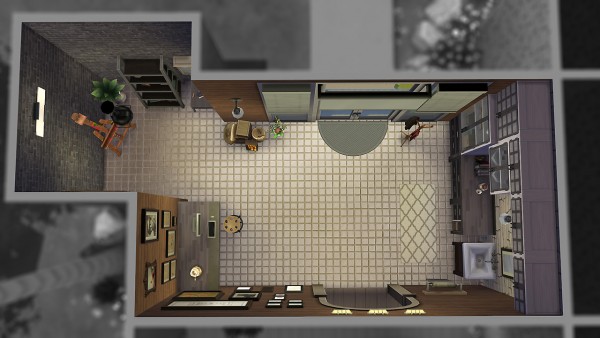
Image resolution: width=600 pixels, height=338 pixels. I want to click on tiles, so click(x=364, y=202).